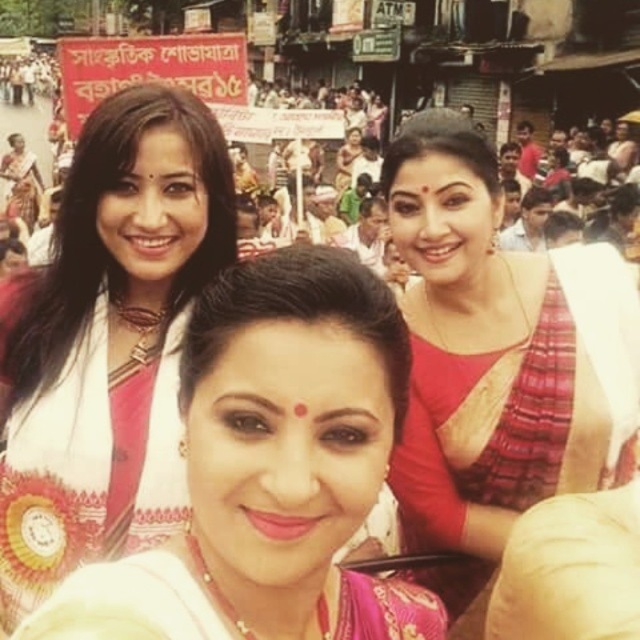
In the scene shown: You are a photographer at the festival and want to capture both the matte white saree at upper left and the matte red saree at upper right in a single frame. Based on their positions, which saree should you focus on first to ensure both are in the frame?

The matte white saree at upper left is above the matte red saree at upper right. To capture both in a single frame, focus on the matte white saree at upper left first as it is positioned higher up, allowing the camera to include the lower positioned matte red saree at upper right in the same shot.

Based on the scene description, where is the pink satin saree at center located in the image?

The pink satin saree at center is located at point [292,448] in the image.

In the scene shown: You are a photographer positioned at the front of the crowd. You want to capture a clear shot of both the pink satin saree at center and the matte red saree at upper right. Which saree will appear larger in your photo?

The pink satin saree at center will appear larger in the photo because it is closer to the viewer than the matte red saree at upper right.